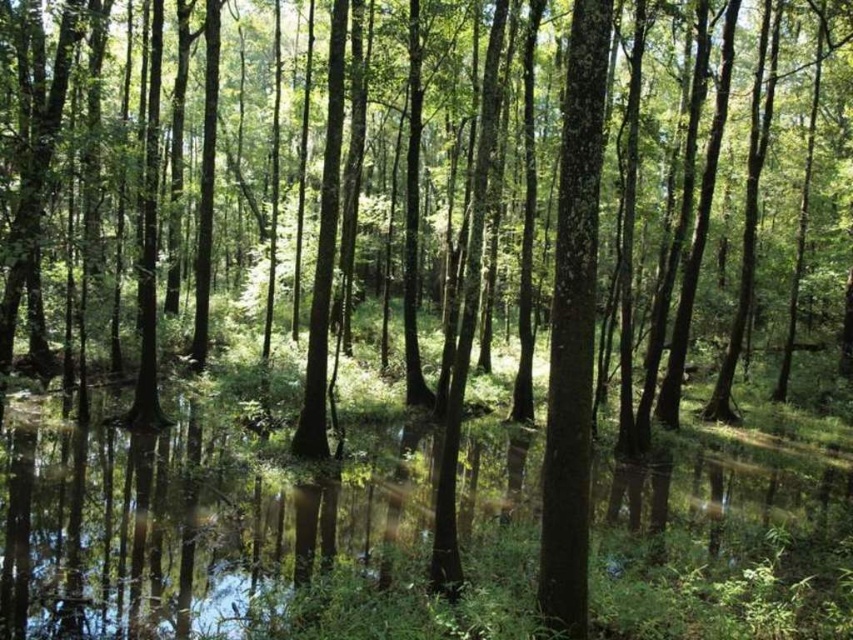
You are standing in a forest and want to take a photo of the point at coordinates point (x=607, y=180). If your camera has a maximum focus range of 30 meters, will it be able to focus on that point?

The distance of point (x=607, y=180) from camera is 29.17 meters, which is within the camera maximum focus range of 30 meters. Therefore, the camera can focus on that point.

You are standing at the origin point in the forest scene. You want to locate the smooth bark tree at center. Which direction should you move in to reach it?

The smooth bark tree at center is located at coordinates point (x=527, y=198), so you should move towards the northeast direction to reach it.